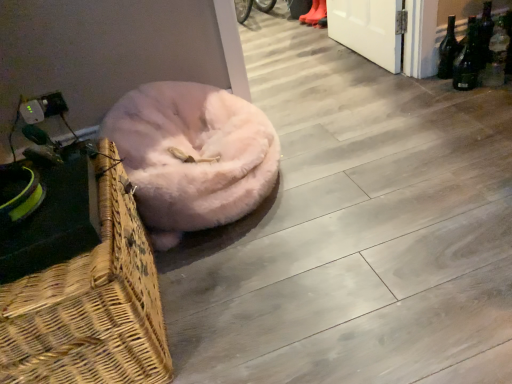
What are the coordinates of `vacant area that is in front of dark green glass bottle at upper right, the 1th bottle from the left` in the screenshot? It's located at (457, 94).